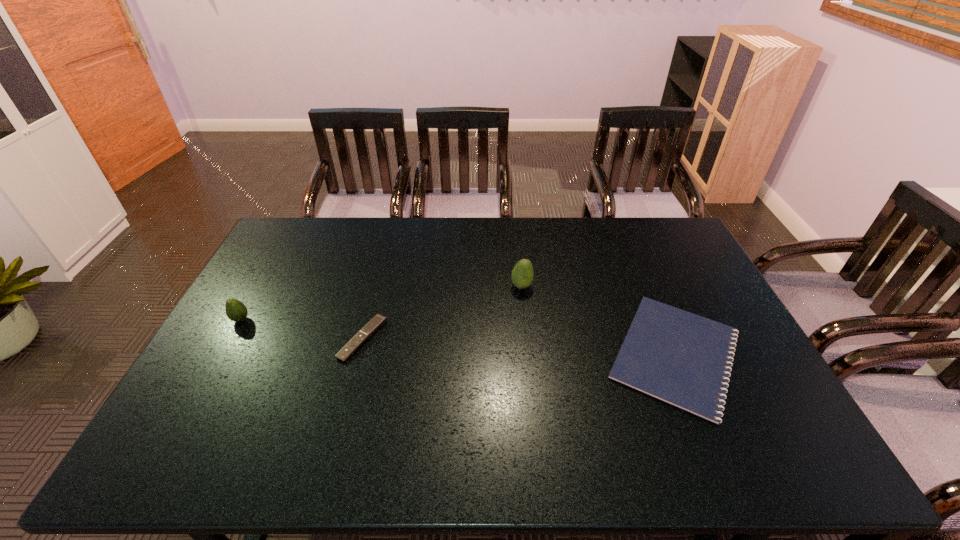
Locate an element on the screen. free spot between the second shortest object and the rightmost object is located at coordinates pos(519,347).

The height and width of the screenshot is (540, 960). I want to click on vacant space that is in between the third shortest object and the remote control, so click(301, 329).

This screenshot has height=540, width=960. I want to click on vacant area that lies between the left avocado and the remote control, so click(x=301, y=329).

Where is `empty location between the right avocado and the rightmost object`? empty location between the right avocado and the rightmost object is located at coordinates (598, 320).

Identify the location of vacant area that lies between the second shortest object and the nearer avocado. (301, 329).

The height and width of the screenshot is (540, 960). In order to click on vacant point located between the third object from left to right and the third object from right to left in this screenshot , I will do `click(443, 313)`.

Where is `vacant space in between the leftmost object and the notepad`? vacant space in between the leftmost object and the notepad is located at coordinates (458, 337).

The image size is (960, 540). I want to click on blank region between the shortest object and the second object from left to right, so click(x=519, y=347).

The image size is (960, 540). I want to click on object that is the third closest to the shorter avocado, so click(x=683, y=359).

Identify which object is the second nearest to the rightmost object. Please provide its 2D coordinates. Your answer should be formatted as a tuple, i.e. [(x, y)], where the tuple contains the x and y coordinates of a point satisfying the conditions above.

[(378, 320)]